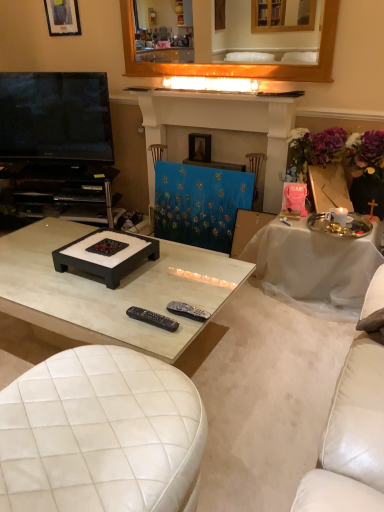
Question: Is black plastic entertainment center at left surrounding black plastic remote at center, the second remote control from the left?

Choices:
 (A) no
 (B) yes

Answer: (A)

Question: Does black plastic entertainment center at left come behind black plastic remote at center, the second remote control from the left?

Choices:
 (A) yes
 (B) no

Answer: (A)

Question: Is black plastic entertainment center at left aimed at black plastic remote at center, the second remote control from the left?

Choices:
 (A) no
 (B) yes

Answer: (A)

Question: Does black plastic entertainment center at left have a lesser width compared to black plastic remote at center, marked as the 1th remote control in a right-to-left arrangement?

Choices:
 (A) no
 (B) yes

Answer: (A)

Question: From the image's perspective, is black plastic entertainment center at left below black plastic remote at center, the second remote control from the left?

Choices:
 (A) yes
 (B) no

Answer: (B)

Question: Is matte black picture frame at upper left, the first picture frame from the top, bigger or smaller than blue fabric painting at center?

Choices:
 (A) big
 (B) small

Answer: (B)

Question: Relative to blue fabric painting at center, is matte black picture frame at upper left, the 1th picture frame in the left-to-right sequence, in front or behind?

Choices:
 (A) front
 (B) behind

Answer: (B)

Question: Is matte black picture frame at upper left, the first picture frame from the top, wider or thinner than blue fabric painting at center?

Choices:
 (A) thin
 (B) wide

Answer: (A)

Question: Is point (46, 17) closer or farther from the camera than point (205, 214)?

Choices:
 (A) farther
 (B) closer

Answer: (A)

Question: Considering the positions of point (158, 318) and point (172, 310), is point (158, 318) closer or farther from the camera than point (172, 310)?

Choices:
 (A) closer
 (B) farther

Answer: (A)

Question: From the image's perspective, is black plastic remote control at center, which ranks as the second remote control in right-to-left order, positioned above or below black plastic remote at center, marked as the 1th remote control in a right-to-left arrangement?

Choices:
 (A) below
 (B) above

Answer: (A)

Question: From a real-world perspective, is black plastic remote control at center, which ranks as the second remote control in right-to-left order, physically located above or below black plastic remote at center, the second remote control from the left?

Choices:
 (A) above
 (B) below

Answer: (A)

Question: Considering the positions of black plastic remote control at center, which is counted as the first remote control, starting from the left, and black plastic remote at center, marked as the 1th remote control in a right-to-left arrangement, in the image, is black plastic remote control at center, which is counted as the first remote control, starting from the left, taller or shorter than black plastic remote at center, marked as the 1th remote control in a right-to-left arrangement,?

Choices:
 (A) short
 (B) tall

Answer: (A)

Question: From a real-world perspective, is wooden mirror at upper center above or below white glossy coffee table at center?

Choices:
 (A) below
 (B) above

Answer: (B)

Question: In terms of height, does wooden mirror at upper center look taller or shorter compared to white glossy coffee table at center?

Choices:
 (A) tall
 (B) short

Answer: (A)